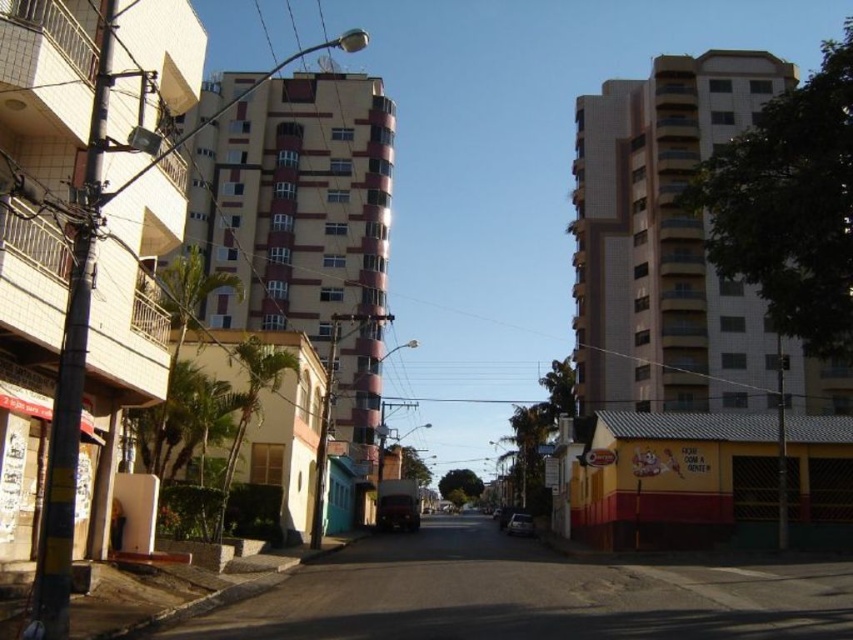
Locate an element on the screen. This screenshot has width=853, height=640. smooth concrete road at center is located at coordinates (531, 595).

Is smooth concrete road at center to the right of shiny black car at center from the viewer's perspective?

Correct, you'll find smooth concrete road at center to the right of shiny black car at center.

Is point (804, 589) farther from viewer compared to point (384, 524)?

No, it is not.

What are the coordinates of `smooth concrete road at center` in the screenshot? It's located at (531, 595).

Can you confirm if shiny black car at center is taller than metallic silver car at center?

Indeed, shiny black car at center has a greater height compared to metallic silver car at center.

Who is shorter, shiny black car at center or metallic silver car at center?

metallic silver car at center is shorter.

Between point (381, 504) and point (509, 522), which one is positioned in front?

Point (381, 504) is more forward.

At what (x,y) coordinates should I click in order to perform the action: click on shiny black car at center. Please return your answer as a coordinate pair (x, y). The height and width of the screenshot is (640, 853). Looking at the image, I should click on (397, 512).

Which is below, smooth concrete road at center or metallic silver car at center?

metallic silver car at center is below.

Can you confirm if smooth concrete road at center is wider than metallic silver car at center?

Correct, the width of smooth concrete road at center exceeds that of metallic silver car at center.

Measure the distance between point (373,577) and camera.

They are 19.15 meters apart.

Identify the location of smooth concrete road at center. The height and width of the screenshot is (640, 853). (531, 595).